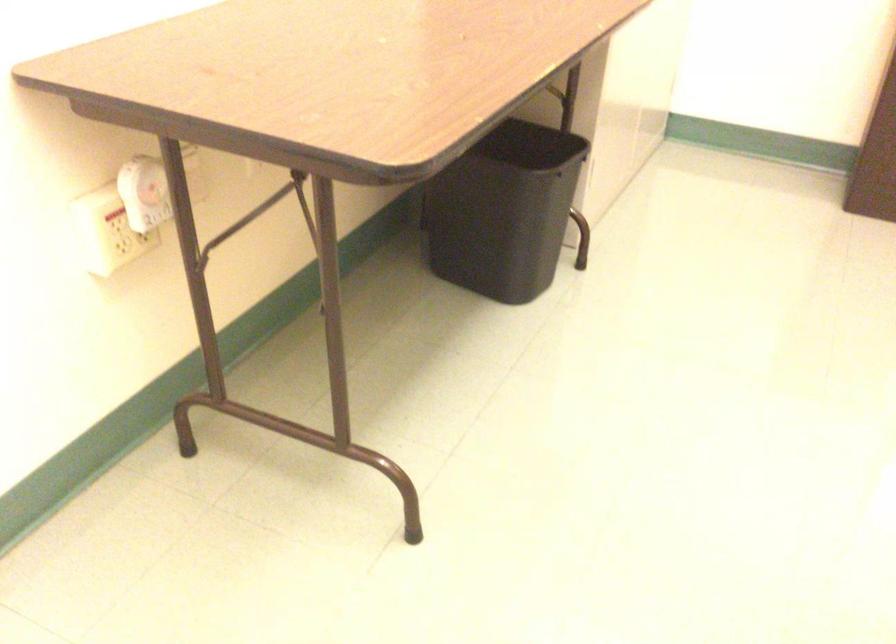
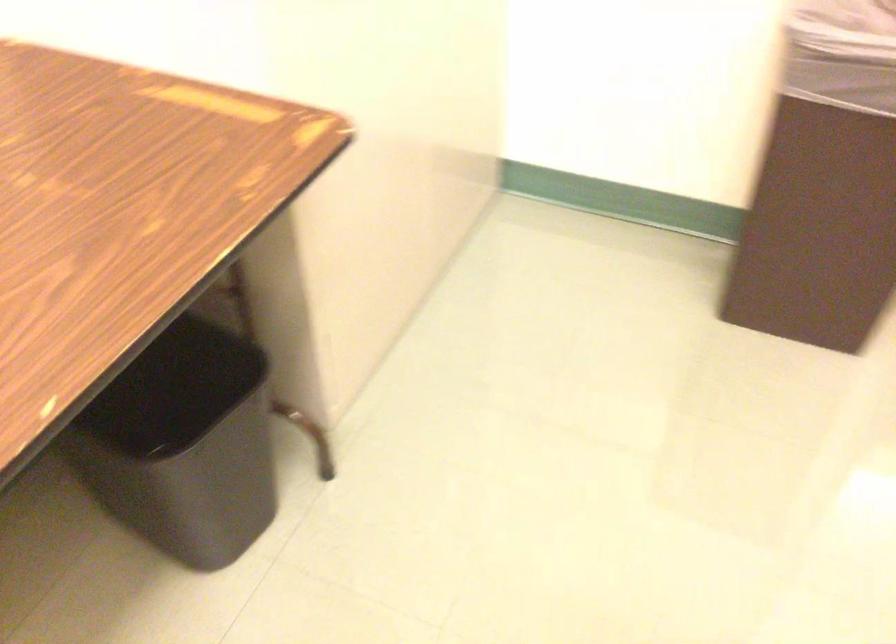
The images are taken continuously from a first-person perspective. In which direction are you moving?

The cameraman walked toward right, forward.